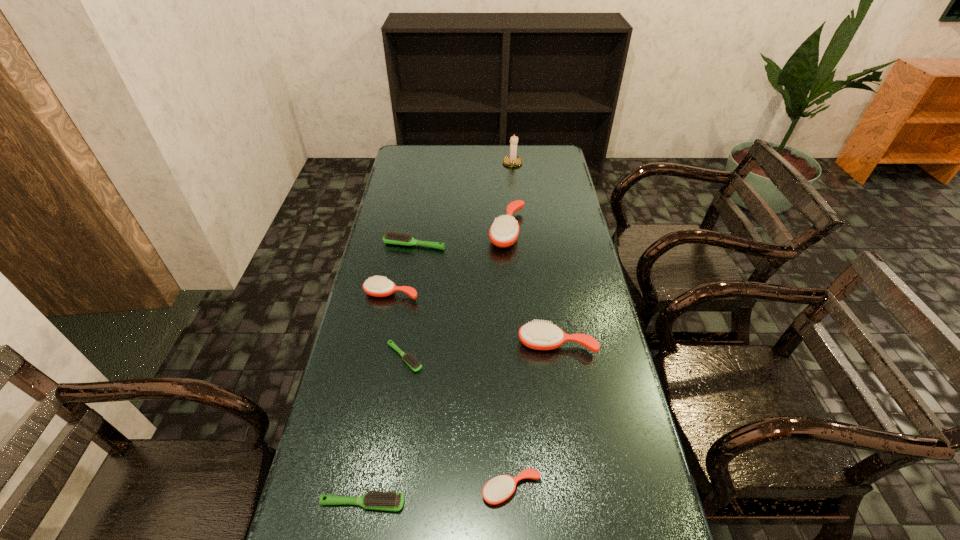
Locate an element on the screen. free space located 0.210m on the back of the second shortest hairbrush is located at coordinates (380, 408).

Where is `vacant space situated on the back of the shortest hairbrush`? vacant space situated on the back of the shortest hairbrush is located at coordinates (409, 326).

Find the location of a particular element. object located at the far edge is located at coordinates [512, 160].

Where is `object located in the right edge section of the desktop`? object located in the right edge section of the desktop is located at coordinates (537, 335).

Locate an element on the screen. free region at the left edge is located at coordinates (396, 211).

Find the location of a particular element. vacant space at the right edge of the desktop is located at coordinates (541, 199).

Where is `vacant space at the far right corner of the desktop`? Image resolution: width=960 pixels, height=540 pixels. vacant space at the far right corner of the desktop is located at coordinates (537, 157).

Where is `vacant point located between the second nearest light hairbrush and the sixth shortest hairbrush`? vacant point located between the second nearest light hairbrush and the sixth shortest hairbrush is located at coordinates (481, 350).

I want to click on empty space between the third farthest hairbrush and the second biggest orange hairbrush, so click(x=474, y=319).

Find the location of a particular element. empty space that is in between the nearest orange hairbrush and the farthest object is located at coordinates (512, 327).